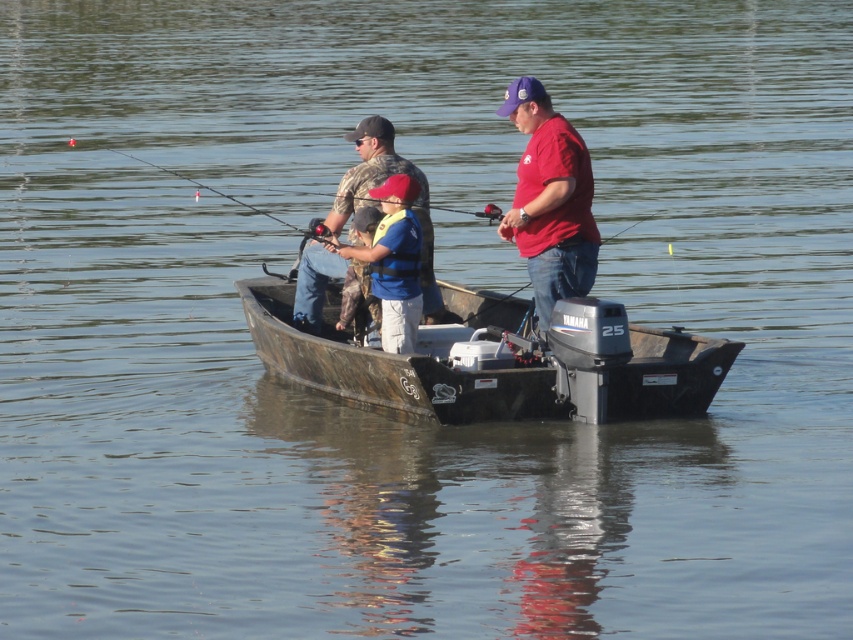
You are a photographer on the dock, and you want to capture a photo of the matte red shirt at center and camouflage fabric jacket at center. Based on their positions, which object should you focus on first if you want to include both in the frame without moving the camera?

The camouflage fabric jacket at center should be focused on first because the matte red shirt at center is to the right of it, so by centering the camouflage fabric jacket at center in the frame, the matte red shirt at center will naturally be included to its right without needing to adjust the camera position.

You are planning to place a rectangular cooler on the camouflage fabric boat at center. The cooler has a width of 40 cm. Considering the boat and the matte red shirt at center, can the cooler fit on the boat?

The camouflage fabric boat at center is wider than the matte red shirt at center. Since the boat is wider, the 40 cm cooler should fit as long as there is enough space not occupied by other items.